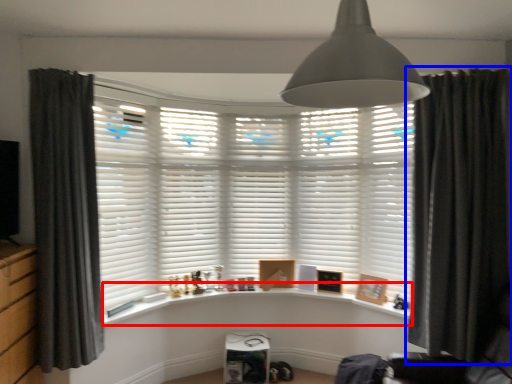
Question: Which object appears closest to the camera in this image, window sill (highlighted by a red box) or curtain (highlighted by a blue box)?

Choices:
 (A) window sill
 (B) curtain

Answer: (B)